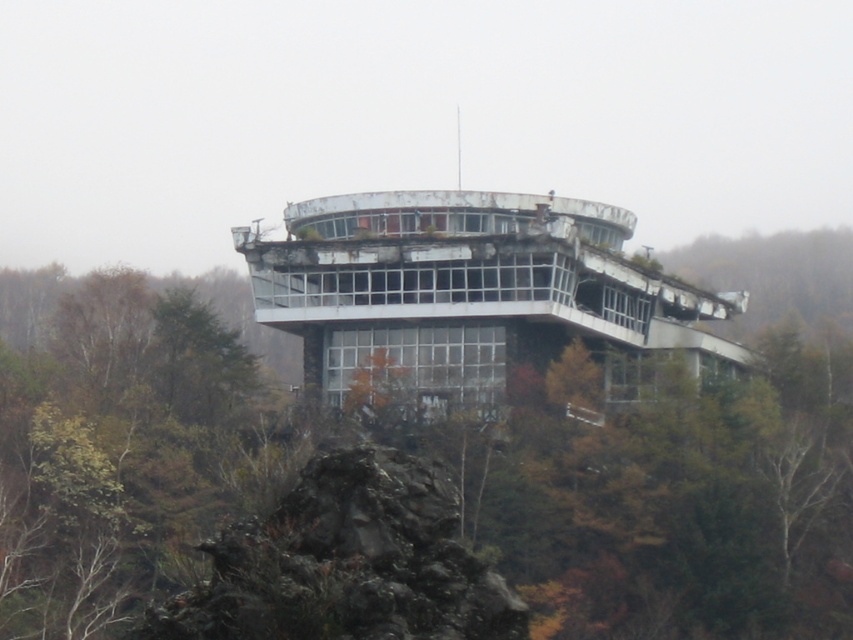
Question: Can you confirm if green leafy tree at center is positioned to the left of dark gray rough rock at center?

Choices:
 (A) yes
 (B) no

Answer: (B)

Question: Which object is farther from the camera taking this photo?

Choices:
 (A) dark gray rough rock at center
 (B) green leafy tree at center

Answer: (A)

Question: Can you confirm if green leafy tree at center is positioned below dark gray rough rock at center?

Choices:
 (A) no
 (B) yes

Answer: (B)

Question: Which object is farther from the camera taking this photo?

Choices:
 (A) dark gray rough rock at center
 (B) green leafy tree at center

Answer: (A)

Question: Can you confirm if green leafy tree at center is positioned to the right of dark gray rough rock at center?

Choices:
 (A) yes
 (B) no

Answer: (A)